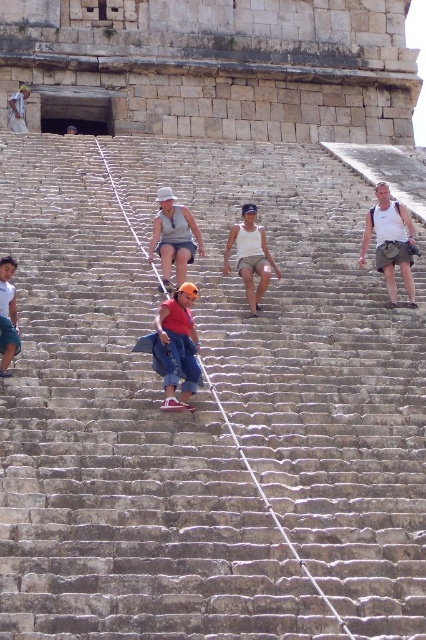
Which is more to the left, matte gray tank top at center or white tank top at center?

From the viewer's perspective, matte gray tank top at center appears more on the left side.

Can you confirm if matte gray tank top at center is positioned to the left of white tank top at center?

→ Indeed, matte gray tank top at center is positioned on the left side of white tank top at center.

Between point (152, 252) and point (247, 214), which one is positioned in front?

Point (152, 252) is in front.

Find the location of a particular element. The height and width of the screenshot is (640, 426). matte gray tank top at center is located at coordinates (173, 237).